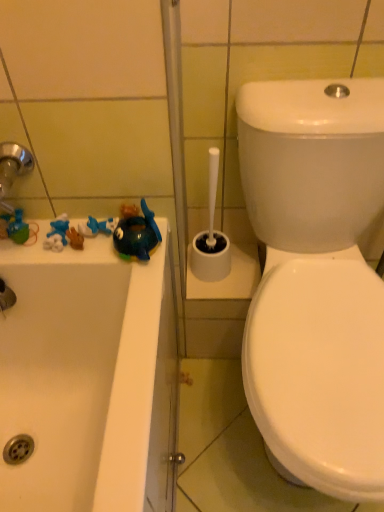
This screenshot has height=512, width=384. Identify the location of blue rubber toy at left, which is the 2th toy in right-to-left order. (97, 226).

The height and width of the screenshot is (512, 384). What do you see at coordinates (211, 236) in the screenshot? I see `white plastic toilet brush holder at center` at bounding box center [211, 236].

Where is `white plastic toilet brush holder at center`? white plastic toilet brush holder at center is located at coordinates (211, 236).

Describe the element at coordinates (18, 228) in the screenshot. I see `matte green toy at left, acting as the first toy starting from the left` at that location.

Find the location of a particular element. blue rubber toy at left, which is the 2th toy in right-to-left order is located at coordinates (97, 226).

Is matte green toy at left, acting as the first toy starting from the left, looking in the opposite direction of white plastic toilet brush holder at center?

matte green toy at left, acting as the first toy starting from the left, does not have its back to white plastic toilet brush holder at center.

Where is `toy that is the 3rd object to the left of the white plastic toilet brush holder at center, starting at the anchor`? Image resolution: width=384 pixels, height=512 pixels. toy that is the 3rd object to the left of the white plastic toilet brush holder at center, starting at the anchor is located at coordinates (18, 228).

Can you see matte green toy at left, the third toy viewed from the right, touching white plastic toilet brush holder at center?

No, matte green toy at left, the third toy viewed from the right, is not with white plastic toilet brush holder at center.

From the image's perspective, is matte green toy at left, the third toy viewed from the right, over white plastic toilet brush holder at center?

No, from the image's perspective, matte green toy at left, the third toy viewed from the right, is not over white plastic toilet brush holder at center.

Considering the relative sizes of blue rubber toy at left, which is the 2th toy in right-to-left order, and glossy plastic toy at left, acting as the third toy starting from the left, in the image provided, is blue rubber toy at left, which is the 2th toy in right-to-left order, wider than glossy plastic toy at left, acting as the third toy starting from the left,?

Incorrect, the width of blue rubber toy at left, which is the 2th toy in right-to-left order, does not surpass that of glossy plastic toy at left, acting as the third toy starting from the left.

Considering the positions of points (79, 225) and (149, 244), is point (79, 225) farther from camera compared to point (149, 244)?

Yes, it is.

There is a glossy plastic toy at left, the 1th toy from the right. At what (x,y) coordinates should I click in order to perform the action: click on the 2nd toy above it (from the image's perspective). Please return your answer as a coordinate pair (x, y). This screenshot has width=384, height=512. Looking at the image, I should click on (97, 226).

Which object is further away from the camera taking this photo, blue rubber toy at left, the second toy positioned from the left, or glossy plastic toy at left, acting as the third toy starting from the left?

blue rubber toy at left, the second toy positioned from the left.

Are glossy plastic toy at left, acting as the third toy starting from the left, and white plastic toilet brush holder at center far apart?

No.

Image resolution: width=384 pixels, height=512 pixels. I want to click on toy that is the 3rd object located below the white plastic toilet brush holder at center (from the image's perspective), so click(137, 234).

From a real-world perspective, which object stands above the other?

glossy plastic toy at left, the 1th toy from the right.

Is white plastic toilet brush holder at center at the back of glossy plastic toy at left, the 1th toy from the right?

glossy plastic toy at left, the 1th toy from the right, does not have its back to white plastic toilet brush holder at center.

From the image's perspective, which one is positioned higher, white plastic toilet brush holder at center or glossy plastic toy at left, the 1th toy from the right?

white plastic toilet brush holder at center appears higher in the image.

Considering the sizes of white plastic toilet brush holder at center and glossy plastic toy at left, the 1th toy from the right, in the image, is white plastic toilet brush holder at center bigger or smaller than glossy plastic toy at left, the 1th toy from the right,?

Clearly, white plastic toilet brush holder at center is larger in size than glossy plastic toy at left, the 1th toy from the right.

Is white plastic toilet brush holder at center wider or thinner than glossy plastic toy at left, the 1th toy from the right?

In the image, white plastic toilet brush holder at center appears to be wider than glossy plastic toy at left, the 1th toy from the right.

Is point (194, 264) closer or farther from the camera than point (140, 260)?

Point (194, 264) is positioned farther from the camera compared to point (140, 260).

From the image's perspective, is matte green toy at left, the third toy viewed from the right, positioned above or below glossy plastic toy at left, acting as the third toy starting from the left?

Clearly, from the image's perspective, matte green toy at left, the third toy viewed from the right, is above glossy plastic toy at left, acting as the third toy starting from the left.

Is matte green toy at left, acting as the first toy starting from the left, shorter than glossy plastic toy at left, acting as the third toy starting from the left?

Yes, matte green toy at left, acting as the first toy starting from the left, is shorter than glossy plastic toy at left, acting as the third toy starting from the left.

Which of these two, matte green toy at left, acting as the first toy starting from the left, or glossy plastic toy at left, the 1th toy from the right, is bigger?

With larger size is glossy plastic toy at left, the 1th toy from the right.

Is matte green toy at left, the third toy viewed from the right, positioned before glossy plastic toy at left, the 1th toy from the right?

No.

From the image's perspective, between matte green toy at left, acting as the first toy starting from the left, and blue rubber toy at left, which is the 2th toy in right-to-left order, who is located below?

matte green toy at left, acting as the first toy starting from the left, from the image's perspective.

Where is `toy lying on the left of blue rubber toy at left, the second toy positioned from the left`? This screenshot has width=384, height=512. toy lying on the left of blue rubber toy at left, the second toy positioned from the left is located at coordinates (18, 228).

Does matte green toy at left, acting as the first toy starting from the left, have a lesser height compared to blue rubber toy at left, the second toy positioned from the left?

In fact, matte green toy at left, acting as the first toy starting from the left, may be taller than blue rubber toy at left, the second toy positioned from the left.

Is matte green toy at left, the third toy viewed from the right, oriented towards blue rubber toy at left, which is the 2th toy in right-to-left order?

No.

Is glossy plastic toy at left, the 1th toy from the right, positioned far away from blue rubber toy at left, which is the 2th toy in right-to-left order?

glossy plastic toy at left, the 1th toy from the right, is actually quite close to blue rubber toy at left, which is the 2th toy in right-to-left order.

Considering the positions of point (135, 220) and point (89, 229), is point (135, 220) closer or farther from the camera than point (89, 229)?

Point (135, 220).

The image size is (384, 512). Identify the location of toy in front of the blue rubber toy at left, the second toy positioned from the left. (137, 234).

Does glossy plastic toy at left, acting as the third toy starting from the left, have a smaller size compared to blue rubber toy at left, the second toy positioned from the left?

Incorrect, glossy plastic toy at left, acting as the third toy starting from the left, is not smaller in size than blue rubber toy at left, the second toy positioned from the left.

Locate an element on the screen. The height and width of the screenshot is (512, 384). the 3rd toy counting from the left side of the white plastic toilet brush holder at center is located at coordinates [x=18, y=228].

What are the coordinates of `toy that appears above the blue rubber toy at left, the second toy positioned from the left (from a real-world perspective)` in the screenshot? It's located at (137, 234).

Estimate the real-world distances between objects in this image. Which object is further from glossy plastic toy at left, acting as the third toy starting from the left, matte green toy at left, acting as the first toy starting from the left, or blue rubber toy at left, which is the 2th toy in right-to-left order?

The object further to glossy plastic toy at left, acting as the third toy starting from the left, is matte green toy at left, acting as the first toy starting from the left.

Estimate the real-world distances between objects in this image. Which object is further from matte green toy at left, the third toy viewed from the right, white plastic toilet brush holder at center or glossy plastic toy at left, acting as the third toy starting from the left?

white plastic toilet brush holder at center is further to matte green toy at left, the third toy viewed from the right.

From the image, which object appears to be farther from glossy plastic toy at left, the 1th toy from the right, white plastic toilet brush holder at center or matte green toy at left, the third toy viewed from the right?

white plastic toilet brush holder at center.

Which object lies further to the anchor point glossy plastic toy at left, acting as the third toy starting from the left, matte green toy at left, acting as the first toy starting from the left, or white plastic toilet brush holder at center?

Among the two, white plastic toilet brush holder at center is located further to glossy plastic toy at left, acting as the third toy starting from the left.

Looking at this image, considering their positions, is glossy plastic toy at left, acting as the third toy starting from the left, positioned further to blue rubber toy at left, the second toy positioned from the left, than white plastic toilet brush holder at center?

white plastic toilet brush holder at center lies further to blue rubber toy at left, the second toy positioned from the left, than the other object.

Estimate the real-world distances between objects in this image. Which object is further from glossy plastic toy at left, the 1th toy from the right, blue rubber toy at left, which is the 2th toy in right-to-left order, or white plastic toilet brush holder at center?

white plastic toilet brush holder at center.

Considering their positions, is matte green toy at left, acting as the first toy starting from the left, positioned closer to white plastic toilet brush holder at center than blue rubber toy at left, which is the 2th toy in right-to-left order?

The object closer to white plastic toilet brush holder at center is blue rubber toy at left, which is the 2th toy in right-to-left order.

When comparing their distances from blue rubber toy at left, which is the 2th toy in right-to-left order, does white plastic toilet brush holder at center or glossy plastic toy at left, acting as the third toy starting from the left, seem closer?

The object closer to blue rubber toy at left, which is the 2th toy in right-to-left order, is glossy plastic toy at left, acting as the third toy starting from the left.

At what (x,y) coordinates should I click in order to perform the action: click on toy between matte green toy at left, acting as the first toy starting from the left, and glossy plastic toy at left, the 1th toy from the right. Please return your answer as a coordinate pair (x, y). Image resolution: width=384 pixels, height=512 pixels. Looking at the image, I should click on (97, 226).

Locate an element on the screen. This screenshot has height=512, width=384. toy between blue rubber toy at left, the second toy positioned from the left, and white plastic toilet brush holder at center from left to right is located at coordinates (137, 234).